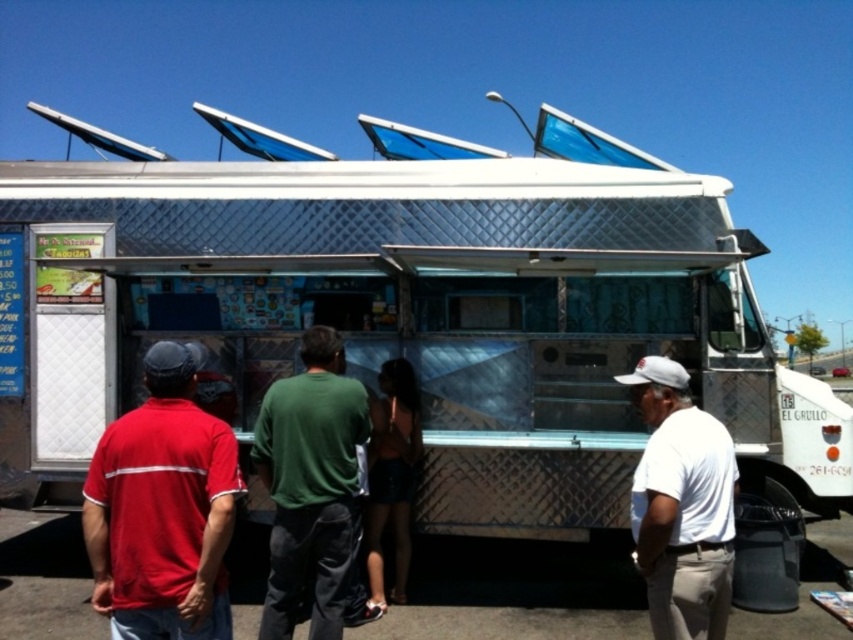
Question: Estimate the real-world distances between objects in this image. Which object is farther from the shiny blue shorts at center?

Choices:
 (A) green cotton shirt at center
 (B) matte red shirt at left

Answer: (B)

Question: Which object appears farthest from the camera in this image?

Choices:
 (A) green cotton shirt at center
 (B) white matte shirt at right

Answer: (A)

Question: Which object is positioned closest to the shiny blue shorts at center?

Choices:
 (A) white matte shirt at right
 (B) silver metallic food truck at center
 (C) green cotton shirt at center
 (D) matte red shirt at left

Answer: (C)

Question: Can you confirm if silver metallic food truck at center is thinner than white matte shirt at right?

Choices:
 (A) yes
 (B) no

Answer: (B)

Question: Does matte red shirt at left have a greater width compared to shiny blue shorts at center?

Choices:
 (A) yes
 (B) no

Answer: (A)

Question: Does silver metallic food truck at center have a greater width compared to white matte shirt at right?

Choices:
 (A) yes
 (B) no

Answer: (A)